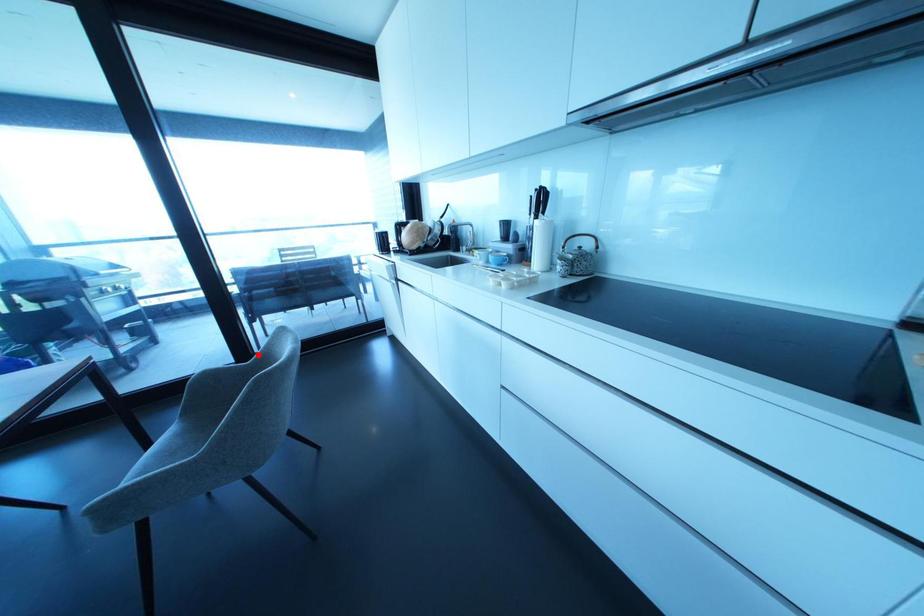
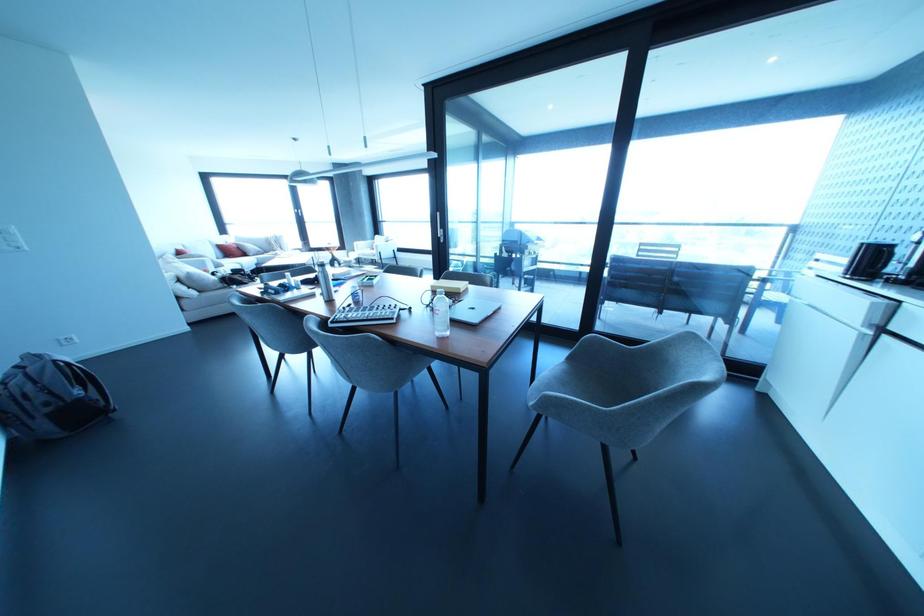
Where in the second image is the point corresponding to the highlighted location from the first image?

(646, 346)